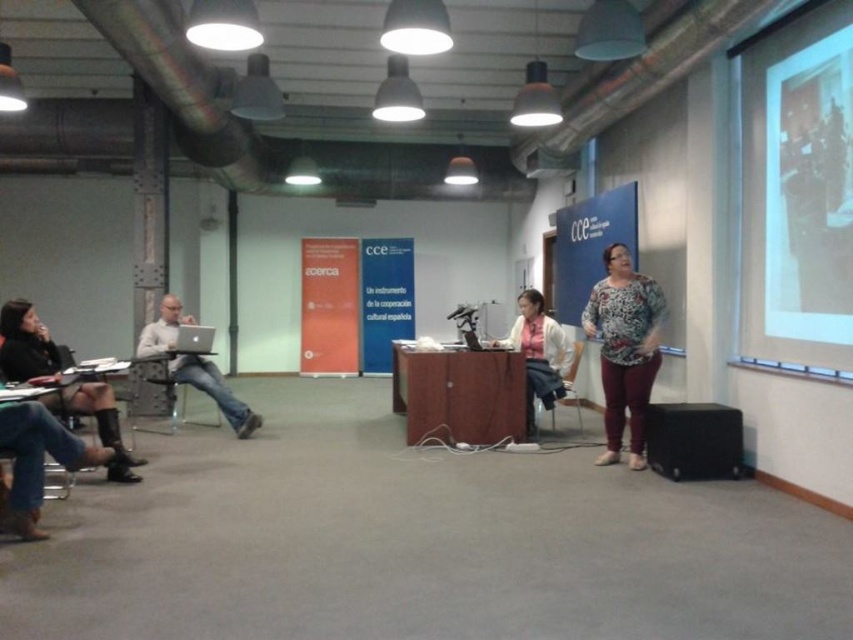
Is black leather boots at lower left further to the viewer compared to metallic silver chair at left?

No, it is in front of metallic silver chair at left.

Who is more distant from viewer, (126, 460) or (138, 410)?

Positioned behind is point (138, 410).

Between point (129, 456) and point (184, 380), which one is positioned behind?

The point (184, 380) is more distant.

Identify the location of black leather boots at lower left. (25, 342).

Does black matte speaker at lower right have a larger size compared to light gray sweater at left?

No, black matte speaker at lower right is not bigger than light gray sweater at left.

Can you confirm if black matte speaker at lower right is positioned above light gray sweater at left?

No.

The width and height of the screenshot is (853, 640). Find the location of `black matte speaker at lower right`. black matte speaker at lower right is located at coordinates (694, 440).

Identify the location of black matte speaker at lower right. The image size is (853, 640). (694, 440).

Is white matte projection screen at upper right shorter than white fabric shirt at center?

No, white matte projection screen at upper right is not shorter than white fabric shirt at center.

Does white matte projection screen at upper right have a smaller size compared to white fabric shirt at center?

Yes.

Is point (793, 225) positioned in front of point (508, 346)?

Yes, it is.

In order to click on white matte projection screen at upper right in this screenshot , I will do `click(798, 188)`.